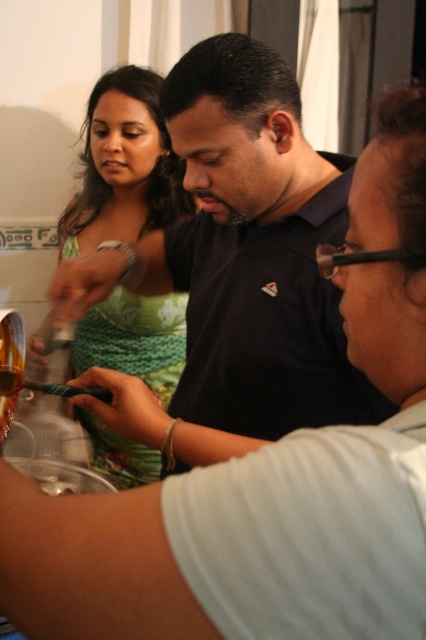
Is dark blue shirt at center taller than green textured dress at upper left?

In fact, dark blue shirt at center may be shorter than green textured dress at upper left.

Does dark blue shirt at center appear on the left side of green textured dress at upper left?

In fact, dark blue shirt at center is to the right of green textured dress at upper left.

Does point (124, 412) lie behind point (95, 88)?

No, (124, 412) is closer to viewer.

At what (x,y) coordinates should I click in order to perform the action: click on dark blue shirt at center. Please return your answer as a coordinate pair (x, y). The image size is (426, 640). Looking at the image, I should click on (236, 269).